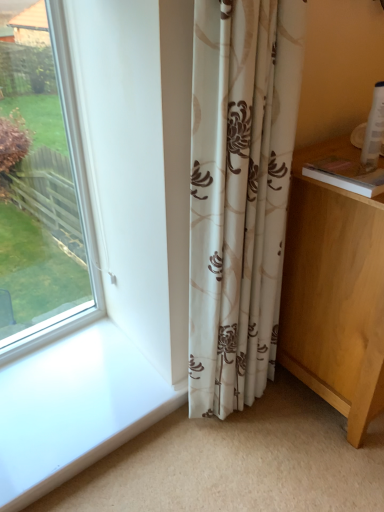
Question: In the image, is beige floral curtain at center on the left side or the right side of light wood vanity at lower right?

Choices:
 (A) left
 (B) right

Answer: (A)

Question: In the image, is beige floral curtain at center positioned in front of or behind light wood vanity at lower right?

Choices:
 (A) behind
 (B) front

Answer: (B)

Question: Which is correct: beige floral curtain at center is inside light wood vanity at lower right, or outside of it?

Choices:
 (A) outside
 (B) inside

Answer: (A)

Question: From the image's perspective, is light wood vanity at lower right above or below beige floral curtain at center?

Choices:
 (A) below
 (B) above

Answer: (A)

Question: Considering the positions of point (352, 441) and point (292, 116), is point (352, 441) closer or farther from the camera than point (292, 116)?

Choices:
 (A) closer
 (B) farther

Answer: (B)

Question: Would you say light wood vanity at lower right is inside or outside beige floral curtain at center?

Choices:
 (A) outside
 (B) inside

Answer: (A)

Question: Is light wood vanity at lower right taller or shorter than beige floral curtain at center?

Choices:
 (A) tall
 (B) short

Answer: (B)